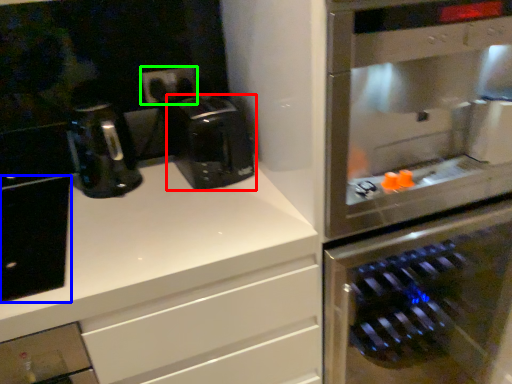
Question: Which is nearer to the coffee maker (highlighted by a red box)? cabinetry (highlighted by a blue box) or electric outlet (highlighted by a green box).

Choices:
 (A) cabinetry
 (B) electric outlet

Answer: (B)